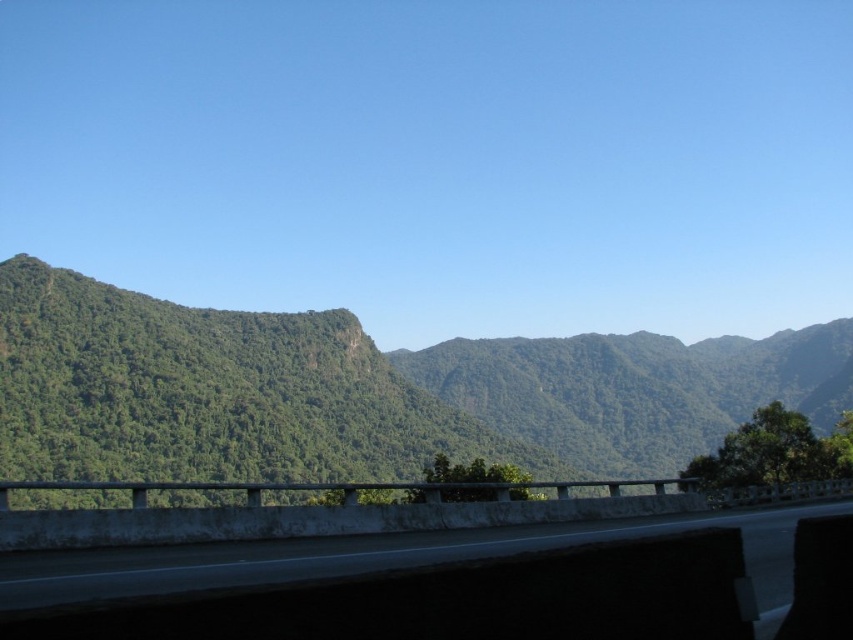
You are a hiker planning to take a photo of the green leafy mountain at left and the concrete at center from a viewpoint. Which object will appear taller in your photo?

The green leafy mountain at left will appear taller in the photo since it has a greater height compared to the concrete at center.

You are a hiker planning to take a photo of the green leafy mountain at left and the concrete at center from the road. Which object will appear wider in your photo?

The green leafy mountain at left will appear wider in the photo since its width surpasses that of the concrete at center.

You are a hiker planning to reach the green leafy mountain at left marked by point (363, 392). The road you are on is bordered by a concrete barrier. Can you drive your car directly to the base of the mountain along the road?

The point (363, 392) marks the green leafy mountain at left, but there is no information provided about the road leading directly to its base. The road curves towards the mountains generally, but the specific path to the mountain at left is unclear. Therefore, it is uncertain if the car can drive directly to the base of the mountain along the road.